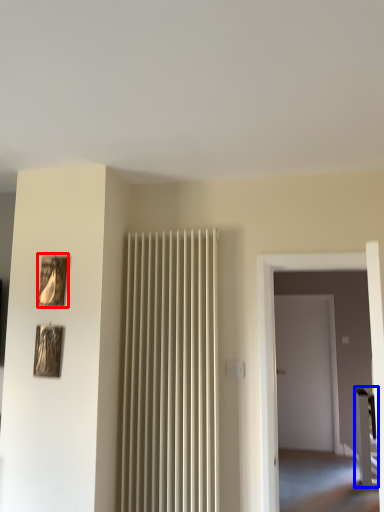
Question: Among these objects, which one is nearest to the camera, picture frame (highlighted by a red box) or furniture (highlighted by a blue box)?

Choices:
 (A) picture frame
 (B) furniture

Answer: (A)